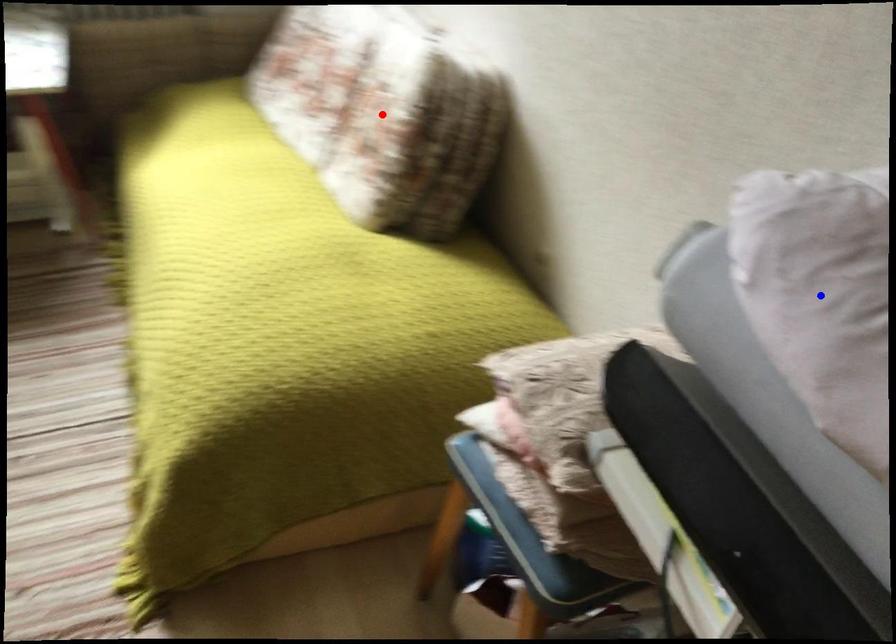
Question: In the image, two points are highlighted. Which point is nearer to the camera? Reply with the corresponding letter.

Choices:
 (A) blue point
 (B) red point

Answer: (A)